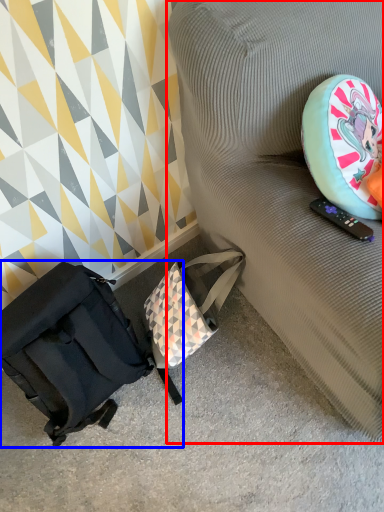
Question: Which object is closer to the camera taking this photo, furniture (highlighted by a red box) or luggage and bags (highlighted by a blue box)?

Choices:
 (A) furniture
 (B) luggage and bags

Answer: (A)